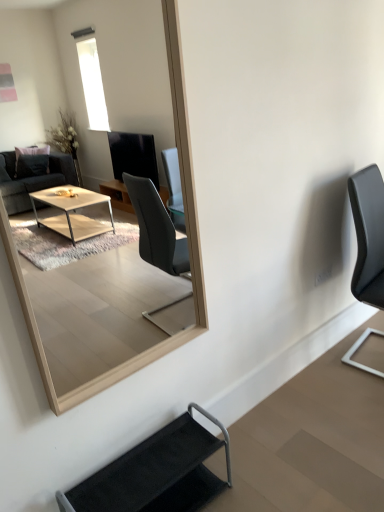
Looking at this image, in order to face black fabric chair at lower center, acting as the 1th chair starting from the left, should I rotate leftwards or rightwards?

A 5.710 degree turn to the left will do.

What do you see at coordinates (368, 234) in the screenshot? This screenshot has width=384, height=512. I see `black leather chair at right, the 1th chair positioned from the back` at bounding box center [368, 234].

This screenshot has width=384, height=512. What do you see at coordinates (103, 77) in the screenshot?
I see `light wood mirror at upper center` at bounding box center [103, 77].

This screenshot has width=384, height=512. What are the coordinates of `black fabric chair at lower center, acting as the 1th chair starting from the left` in the screenshot? It's located at (156, 473).

Is black leather chair at right, which is the 2th chair in bottom-to-top order, oriented away from light wood mirror at upper center?

No, black leather chair at right, which is the 2th chair in bottom-to-top order, is not facing away from light wood mirror at upper center.

From the image's perspective, is black leather chair at right, marked as the 1th chair in a right-to-left arrangement, above light wood mirror at upper center?

Actually, black leather chair at right, marked as the 1th chair in a right-to-left arrangement, appears below light wood mirror at upper center in the image.

Does black leather chair at right, acting as the first chair starting from the top, come behind light wood mirror at upper center?

Yes, black leather chair at right, acting as the first chair starting from the top, is further from the camera.

Consider the image. How distant is light wood mirror at upper center from black fabric chair at lower center, acting as the 1th chair starting from the left?

light wood mirror at upper center and black fabric chair at lower center, acting as the 1th chair starting from the left, are 4.82 meters apart.

From a real-world perspective, is light wood mirror at upper center below black fabric chair at lower center, marked as the 2th chair in a back-to-front arrangement?

No, from a real-world perspective, light wood mirror at upper center is not beneath black fabric chair at lower center, marked as the 2th chair in a back-to-front arrangement.

Considering the sizes of light wood mirror at upper center and black fabric chair at lower center, which ranks as the first chair in bottom-to-top order, in the image, is light wood mirror at upper center bigger or smaller than black fabric chair at lower center, which ranks as the first chair in bottom-to-top order,?

Clearly, light wood mirror at upper center is larger in size than black fabric chair at lower center, which ranks as the first chair in bottom-to-top order.

Is black leather chair at right, the 1th chair positioned from the back, turned away from black fabric chair at lower center, marked as the second chair in a right-to-left arrangement?

No, black leather chair at right, the 1th chair positioned from the back, is not facing the opposite direction of black fabric chair at lower center, marked as the second chair in a right-to-left arrangement.

Looking at this image, how many degrees apart are the facing directions of black leather chair at right, acting as the first chair starting from the top, and black fabric chair at lower center, which ranks as the first chair in bottom-to-top order?

7.3 degrees.

Based on the photo, is black leather chair at right, acting as the first chair starting from the top, placed right next to black fabric chair at lower center, acting as the 1th chair starting from the left?

No, black leather chair at right, acting as the first chair starting from the top, is not touching black fabric chair at lower center, acting as the 1th chair starting from the left.

Between black leather chair at right, the second chair in the left-to-right sequence, and black fabric chair at lower center, acting as the 1th chair starting from the left, which one has less height?

With less height is black fabric chair at lower center, acting as the 1th chair starting from the left.

How many degrees apart are the facing directions of light wood mirror at upper center and black leather chair at right, the 2th chair viewed from the front?

7.31 degrees separate the facing orientations of light wood mirror at upper center and black leather chair at right, the 2th chair viewed from the front.

Is light wood mirror at upper center oriented towards black leather chair at right, acting as the first chair starting from the top?

No, light wood mirror at upper center is not aimed at black leather chair at right, acting as the first chair starting from the top.

Considering the sizes of objects light wood mirror at upper center and black leather chair at right, the second chair in the left-to-right sequence, in the image provided, who is taller, light wood mirror at upper center or black leather chair at right, the second chair in the left-to-right sequence,?

With more height is light wood mirror at upper center.

Is light wood mirror at upper center to the right of black leather chair at right, acting as the first chair starting from the top, from the viewer's perspective?

No, light wood mirror at upper center is not to the right of black leather chair at right, acting as the first chair starting from the top.

From the image's perspective, is black fabric chair at lower center, the 2th chair positioned from the top, located beneath light wood mirror at upper center?

Yes.

From a real-world perspective, which object stands above the other?

light wood mirror at upper center is physically above.

This screenshot has width=384, height=512. Find the location of `the 2nd chair positioned below the light wood mirror at upper center (from the image's perspective)`. the 2nd chair positioned below the light wood mirror at upper center (from the image's perspective) is located at coordinates (156, 473).

Consider the image. From the image's perspective, is black fabric chair at lower center, the first chair from the front, under black leather chair at right, marked as the 1th chair in a right-to-left arrangement?

Indeed, from the image's perspective, black fabric chair at lower center, the first chair from the front, is shown beneath black leather chair at right, marked as the 1th chair in a right-to-left arrangement.

Which object is wider, black fabric chair at lower center, the 2th chair positioned from the top, or black leather chair at right, the 2th chair viewed from the front?

black leather chair at right, the 2th chair viewed from the front, is wider.

Who is smaller, black fabric chair at lower center, which ranks as the first chair in bottom-to-top order, or black leather chair at right, the 1th chair positioned from the back?

Smaller between the two is black fabric chair at lower center, which ranks as the first chair in bottom-to-top order.

In the scene shown: From a real-world perspective, relative to black leather chair at right, which is the 2th chair in bottom-to-top order, is black fabric chair at lower center, the 2th chair positioned from the top, vertically above or below?

In terms of real-world spatial position, black fabric chair at lower center, the 2th chair positioned from the top, is below black leather chair at right, which is the 2th chair in bottom-to-top order.

From the image's perspective, starting from the light wood mirror at upper center, which chair is the 1st one below? Please provide its 2D coordinates.

[(368, 234)]

Where is `mirror located above the black fabric chair at lower center, marked as the second chair in a right-to-left arrangement (from the image's perspective)`? The image size is (384, 512). mirror located above the black fabric chair at lower center, marked as the second chair in a right-to-left arrangement (from the image's perspective) is located at coordinates (103, 77).

In the scene shown: Considering their positions, is black fabric chair at lower center, which ranks as the first chair in bottom-to-top order, positioned further to black leather chair at right, which is the 2th chair in bottom-to-top order, than light wood mirror at upper center?

light wood mirror at upper center lies further to black leather chair at right, which is the 2th chair in bottom-to-top order, than the other object.

When comparing their distances from black fabric chair at lower center, the first chair from the front, does light wood mirror at upper center or black leather chair at right, the 2th chair viewed from the front, seem further?

Based on the image, light wood mirror at upper center appears to be further to black fabric chair at lower center, the first chair from the front.

From the image, which object appears to be nearer to black fabric chair at lower center, marked as the second chair in a right-to-left arrangement, black leather chair at right, marked as the 1th chair in a right-to-left arrangement, or light wood mirror at upper center?

black leather chair at right, marked as the 1th chair in a right-to-left arrangement, is closer to black fabric chair at lower center, marked as the second chair in a right-to-left arrangement.

Which object lies nearer to the anchor point light wood mirror at upper center, black fabric chair at lower center, acting as the 1th chair starting from the left, or black leather chair at right, the 1th chair positioned from the back?

black leather chair at right, the 1th chair positioned from the back.

When comparing their distances from light wood mirror at upper center, does black leather chair at right, which is the 2th chair in bottom-to-top order, or black fabric chair at lower center, marked as the 2th chair in a back-to-front arrangement, seem further?

black fabric chair at lower center, marked as the 2th chair in a back-to-front arrangement, lies further to light wood mirror at upper center than the other object.

Looking at the image, which one is located closer to black leather chair at right, which is the 2th chair in bottom-to-top order, light wood mirror at upper center or black fabric chair at lower center, marked as the 2th chair in a back-to-front arrangement?

black fabric chair at lower center, marked as the 2th chair in a back-to-front arrangement, lies closer to black leather chair at right, which is the 2th chair in bottom-to-top order, than the other object.

Locate an element on the screen. This screenshot has width=384, height=512. chair between light wood mirror at upper center and black leather chair at right, acting as the first chair starting from the top is located at coordinates (156, 473).